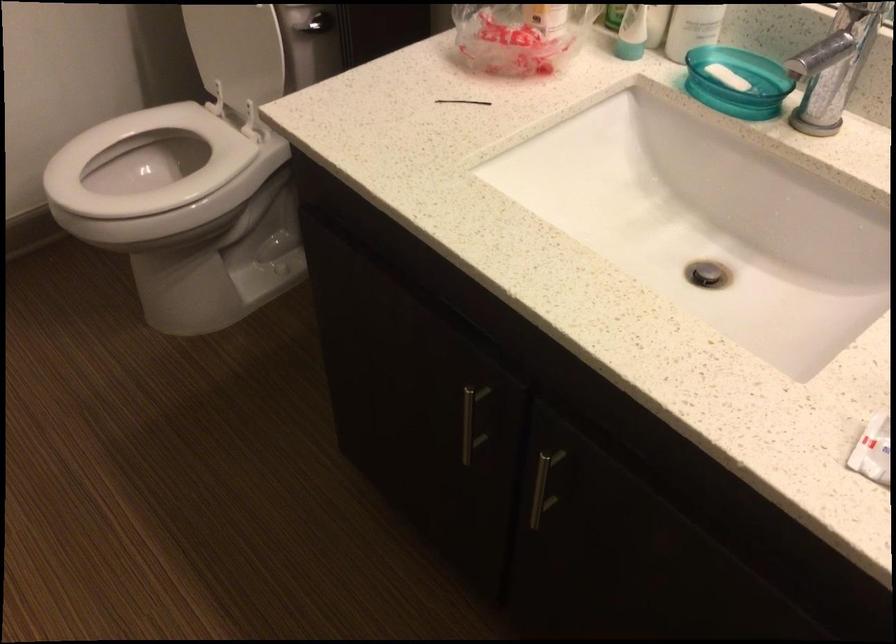
Describe the element at coordinates (237, 51) in the screenshot. This screenshot has width=896, height=644. I see `a white toilet lid` at that location.